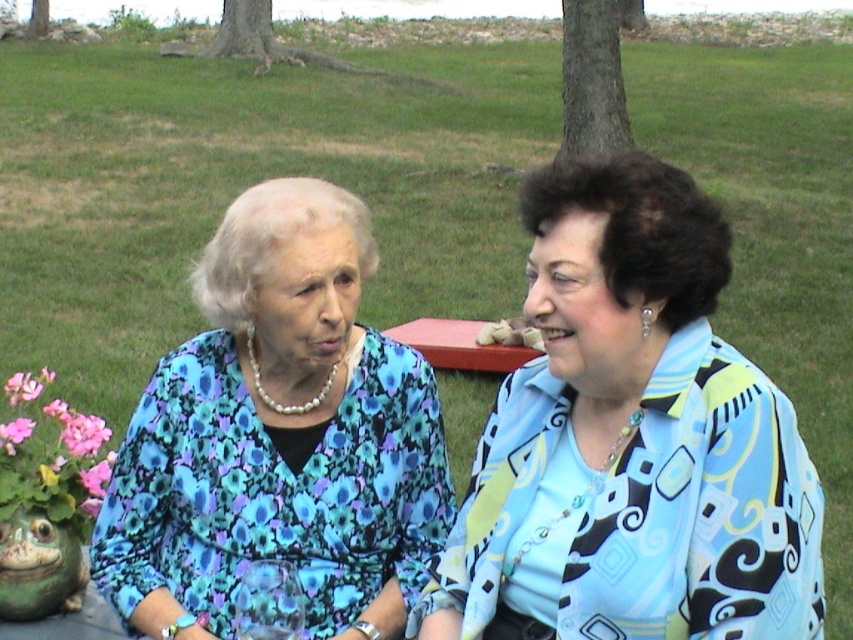
Question: Estimate the real-world distances between objects in this image. Which object is closer to the light blue printed blouse at right?

Choices:
 (A) pink fabric flower at lower left
 (B) floral fabric blouse at center

Answer: (B)

Question: Which point is closer to the camera?

Choices:
 (A) (364, 416)
 (B) (28, 388)

Answer: (A)

Question: Does light blue printed blouse at right appear on the right side of pink fabric flower at lower left?

Choices:
 (A) no
 (B) yes

Answer: (B)

Question: Which of the following is the farthest from the observer?

Choices:
 (A) (645, 412)
 (B) (10, 385)

Answer: (B)

Question: From the image, what is the correct spatial relationship of floral fabric blouse at center in relation to pink fabric flower at lower left?

Choices:
 (A) above
 (B) below

Answer: (A)

Question: In this image, where is floral fabric blouse at center located relative to pink fabric flower at lower left?

Choices:
 (A) below
 (B) above

Answer: (B)